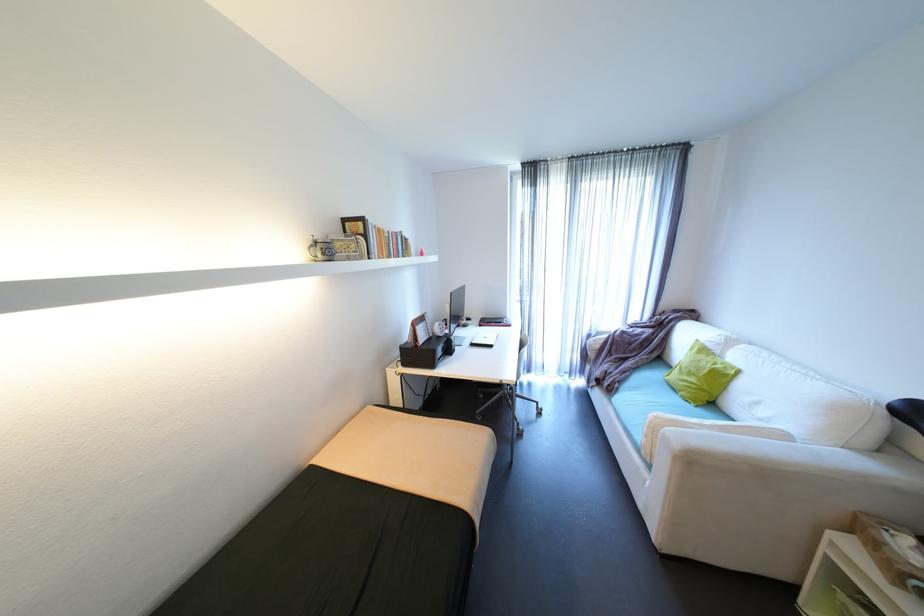
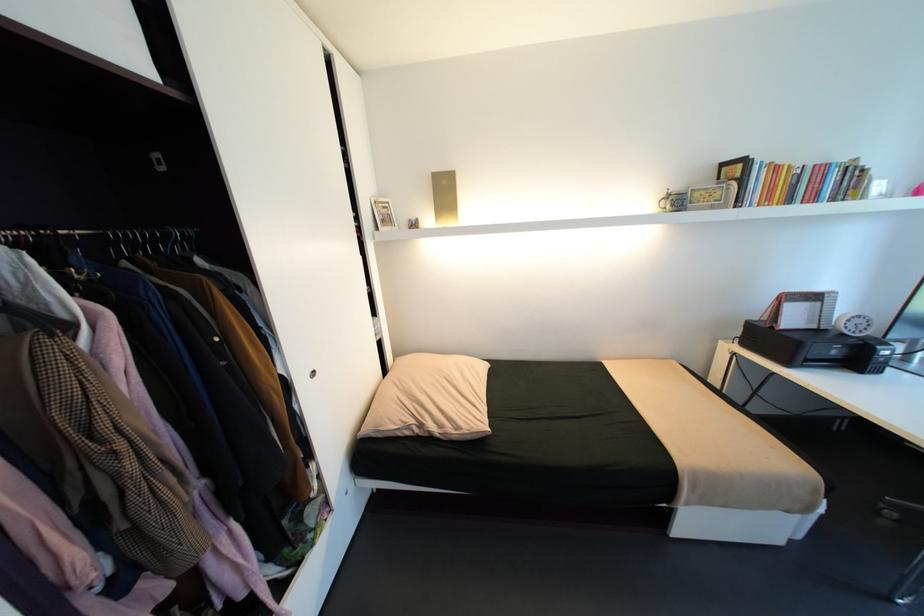
The first image is from the beginning of the video and the second image is from the end. How did the camera likely rotate when shooting the video?

The rotation direction of the camera is left-down.